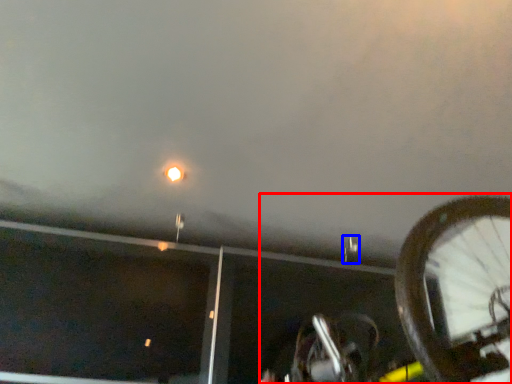
Question: Among these objects, which one is farthest to the camera, bicycle (highlighted by a red box) or street light (highlighted by a blue box)?

Choices:
 (A) bicycle
 (B) street light

Answer: (B)